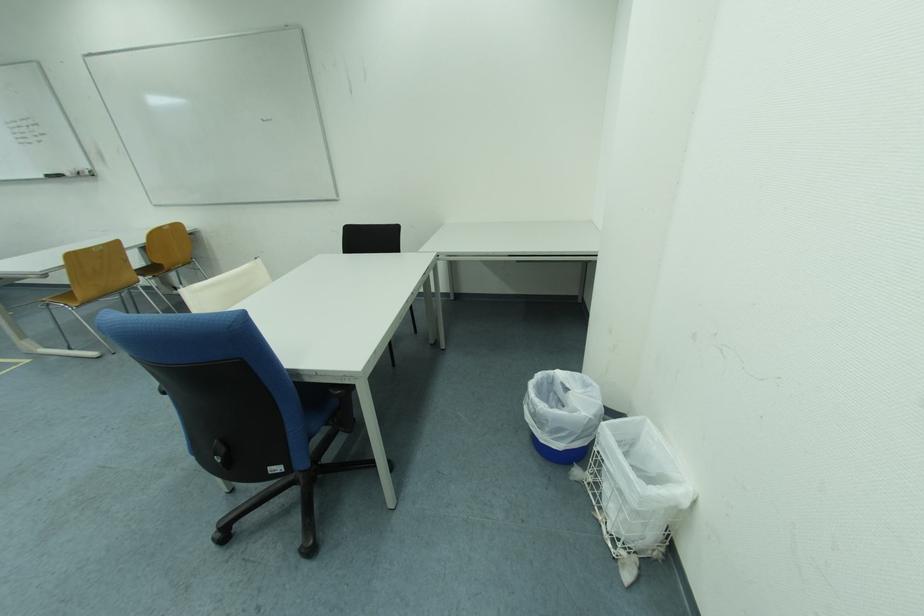
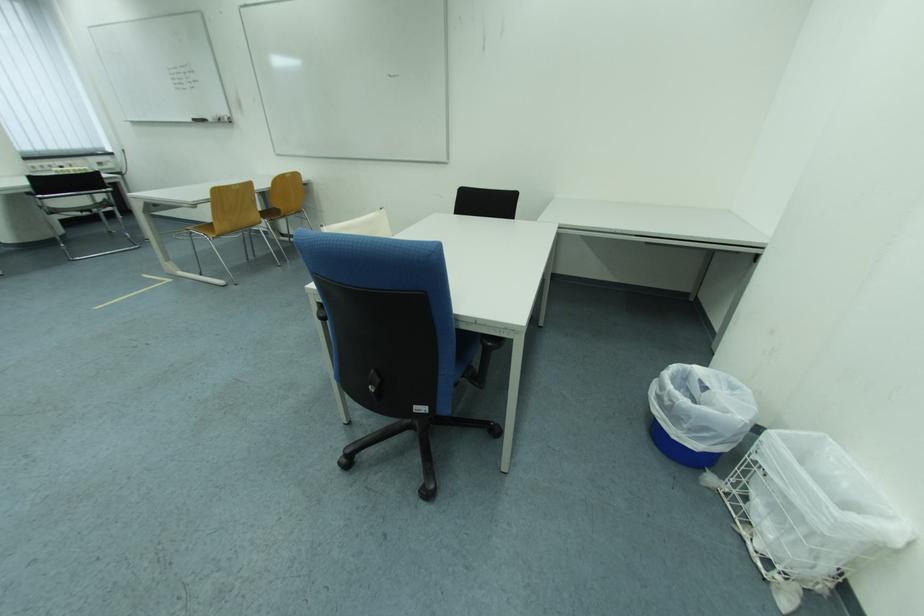
Question: The images are taken continuously from a first-person perspective. In which direction are you moving?

Choices:
 (A) Left
 (B) Right
 (C) Forward
 (D) Backward

Answer: (A)